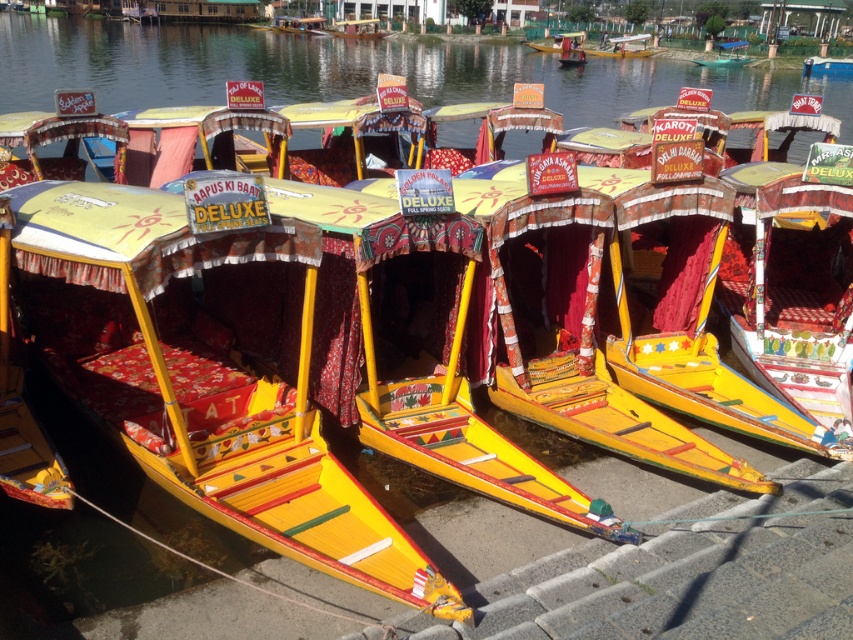
You are standing at the entrance of the canal and want to board the yellow painted wood boat at center. Based on its coordinates, is it positioned closer to the left or right side of the canal?

The yellow painted wood boat at center is located at point 0.597 on the x and y axis, which places it closer to the right side of the canal.

You are a tourist planning to take a ride on one of the shikaras. You notice two boats at the center of the image labeled as yellow painted wood boat at center and matte yellow boat at center. Which one is shorter in height?

The yellow painted wood boat at center is shorter than the matte yellow boat at center.